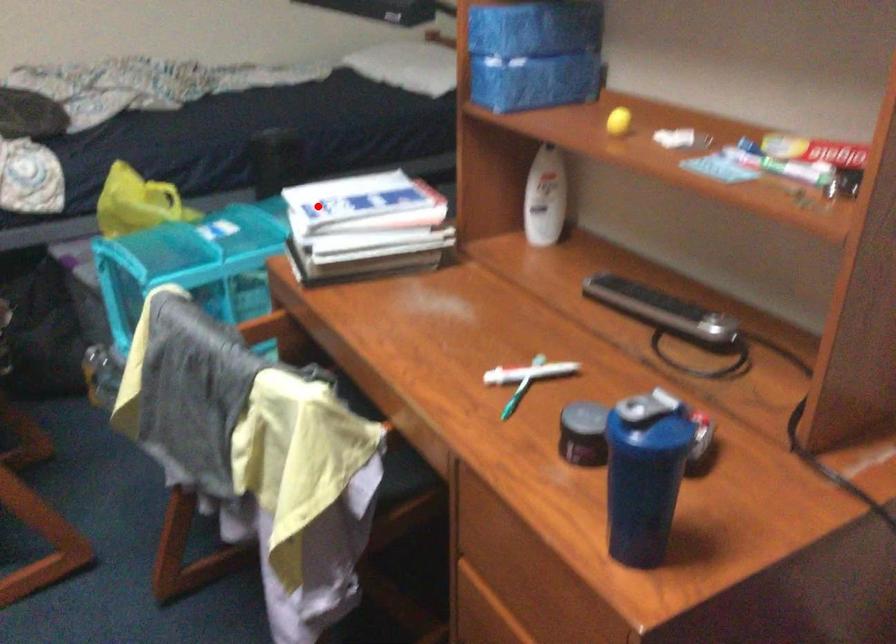
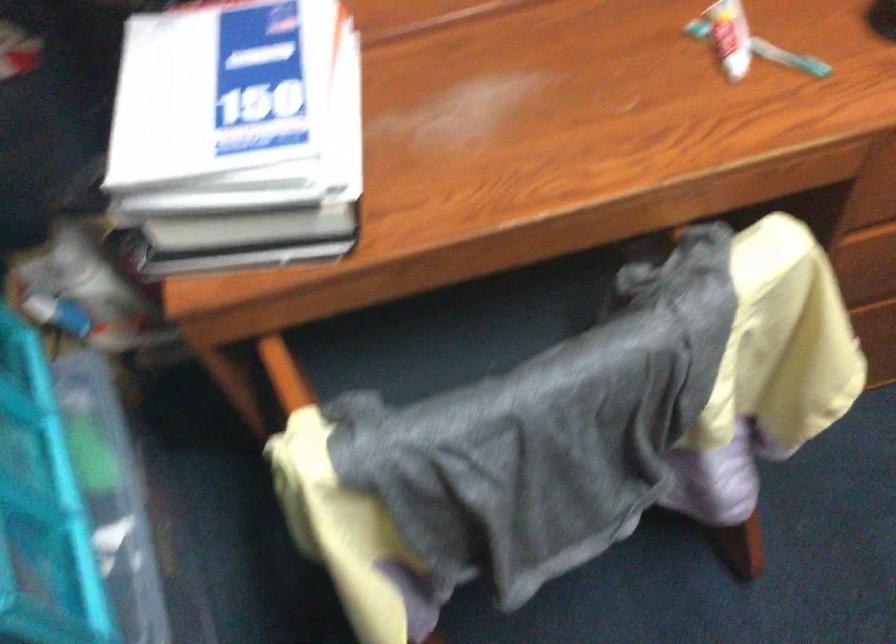
The point at the highlighted location is marked in the first image. Where is the corresponding point in the second image?

(237, 128)